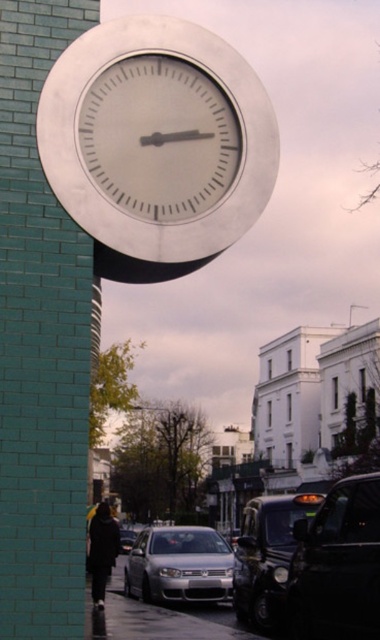
Question: Does shiny black car at lower right appear on the right side of silver metallic sedan at lower center?

Choices:
 (A) no
 (B) yes

Answer: (B)

Question: Which of the following is the farthest from the observer?

Choices:
 (A) shiny black car at center
 (B) silver metallic car at lower center
 (C) silver metallic clock at upper center
 (D) shiny black car at lower right

Answer: (B)

Question: Can you confirm if shiny black car at lower right is positioned above shiny black car at center?

Choices:
 (A) no
 (B) yes

Answer: (B)

Question: Which object appears farthest from the camera in this image?

Choices:
 (A) silver metallic clock at upper center
 (B) silver metallic car at lower center
 (C) shiny black car at center

Answer: (B)

Question: Can you confirm if silver metallic car at lower center is positioned to the left of silver metallic sedan at lower center?

Choices:
 (A) yes
 (B) no

Answer: (B)

Question: Estimate the real-world distances between objects in this image. Which object is farther from the shiny black car at center?

Choices:
 (A) silver metallic sedan at lower center
 (B) silver metallic car at lower center

Answer: (A)